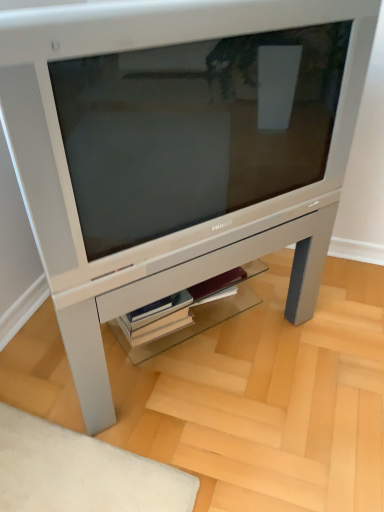
Where is `white glossy shelf at center`? Image resolution: width=384 pixels, height=512 pixels. white glossy shelf at center is located at coordinates (189, 313).

I want to click on white glossy shelf at center, so click(189, 313).

From the image's perspective, is satin silver table at center on white glossy shelf at center?

Correct, satin silver table at center appears higher than white glossy shelf at center in the image.

Identify the location of table that appears above the white glossy shelf at center (from the image's perspective). This screenshot has width=384, height=512. (182, 288).

Considering the positions of point (312, 290) and point (245, 269), is point (312, 290) closer or farther from the camera than point (245, 269)?

Point (312, 290).

Is white glossy shelf at center at the back of satin silver table at center?

Yes, satin silver table at center is facing away from white glossy shelf at center.

From the image's perspective, is white glossy shelf at center under satin silver monitor at center?

Correct, white glossy shelf at center appears lower than satin silver monitor at center in the image.

Between white glossy shelf at center and satin silver monitor at center, which one has less height?

Standing shorter between the two is white glossy shelf at center.

How different are the orientations of white glossy shelf at center and satin silver monitor at center in degrees?

There is a 0.644-degree angle between the facing directions of white glossy shelf at center and satin silver monitor at center.

Is point (178, 334) closer or farther from the camera than point (299, 30)?

Point (178, 334) appears to be farther away from the viewer than point (299, 30).

Find the location of a particular element. The width and height of the screenshot is (384, 512). computer monitor above the satin silver table at center (from a real-world perspective) is located at coordinates (195, 129).

Is satin silver table at center positioned with its back to satin silver monitor at center?

That's not correct — satin silver table at center is not looking away from satin silver monitor at center.

Is the surface of satin silver table at center in direct contact with satin silver monitor at center?

They are not placed beside each other.

Between point (74, 316) and point (102, 112), which one is positioned behind?

Point (74, 316)

Which point is more forward, (153, 85) or (203, 270)?

The point (153, 85) is in front.

Between satin silver monitor at center and satin silver table at center, which one has larger width?

Wider between the two is satin silver table at center.

Considering the relative sizes of satin silver monitor at center and satin silver table at center in the image provided, is satin silver monitor at center shorter than satin silver table at center?

Yes.

How different are the orientations of satin silver monitor at center and satin silver table at center in degrees?

There is a 4.68e-06-degree angle between the facing directions of satin silver monitor at center and satin silver table at center.

Is satin silver monitor at center far away from white glossy shelf at center?

satin silver monitor at center is actually quite close to white glossy shelf at center.

Who is smaller, satin silver monitor at center or white glossy shelf at center?

white glossy shelf at center is smaller.

Is satin silver monitor at center facing towards white glossy shelf at center?

No, satin silver monitor at center is not facing towards white glossy shelf at center.

From the image's perspective, is white glossy shelf at center above or below satin silver table at center?

Based on their image positions, white glossy shelf at center is located beneath satin silver table at center.

Considering the points (203, 295) and (104, 403), which point is in front, point (203, 295) or point (104, 403)?

The point (104, 403) is closer to the camera.

How much distance is there between white glossy shelf at center and satin silver table at center?

They are 24.60 centimeters apart.

Is white glossy shelf at center oriented towards satin silver table at center?

Yes, white glossy shelf at center is aimed at satin silver table at center.

Where is `shelf below the satin silver table at center (from a real-world perspective)`? The width and height of the screenshot is (384, 512). shelf below the satin silver table at center (from a real-world perspective) is located at coordinates point(189,313).

The height and width of the screenshot is (512, 384). What are the coordinates of `computer monitor above the white glossy shelf at center (from a real-world perspective)` in the screenshot? It's located at (195, 129).

Estimate the real-world distances between objects in this image. Which object is closer to satin silver table at center, white glossy shelf at center or satin silver monitor at center?

white glossy shelf at center lies closer to satin silver table at center than the other object.

Which object lies nearer to the anchor point satin silver monitor at center, white glossy shelf at center or satin silver table at center?

satin silver table at center.

Looking at this image, which object lies nearer to the anchor point satin silver monitor at center, satin silver table at center or white glossy shelf at center?

satin silver table at center is positioned closer to the anchor satin silver monitor at center.

Estimate the real-world distances between objects in this image. Which object is closer to white glossy shelf at center, satin silver monitor at center or satin silver table at center?

satin silver table at center lies closer to white glossy shelf at center than the other object.

Based on their spatial positions, is satin silver table at center or satin silver monitor at center further from white glossy shelf at center?

Based on the image, satin silver monitor at center appears to be further to white glossy shelf at center.

When comparing their distances from satin silver table at center, does satin silver monitor at center or white glossy shelf at center seem closer?

white glossy shelf at center is positioned closer to the anchor satin silver table at center.

What are the coordinates of `table positioned between satin silver monitor at center and white glossy shelf at center from near to far` in the screenshot? It's located at (182, 288).